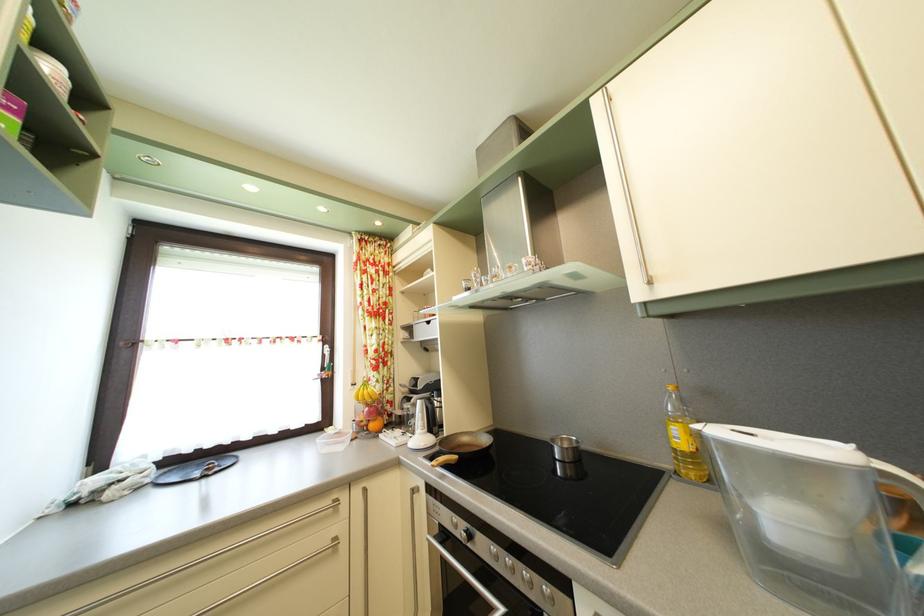
In order to click on yellow oil bottle in this screenshot , I will do `click(683, 438)`.